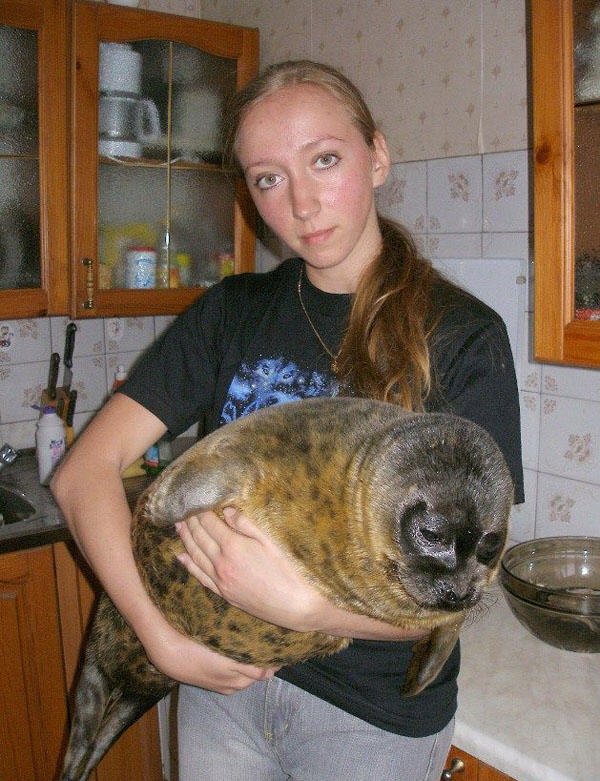
Identify the location of handle. Image resolution: width=600 pixels, height=781 pixels. (91, 287).